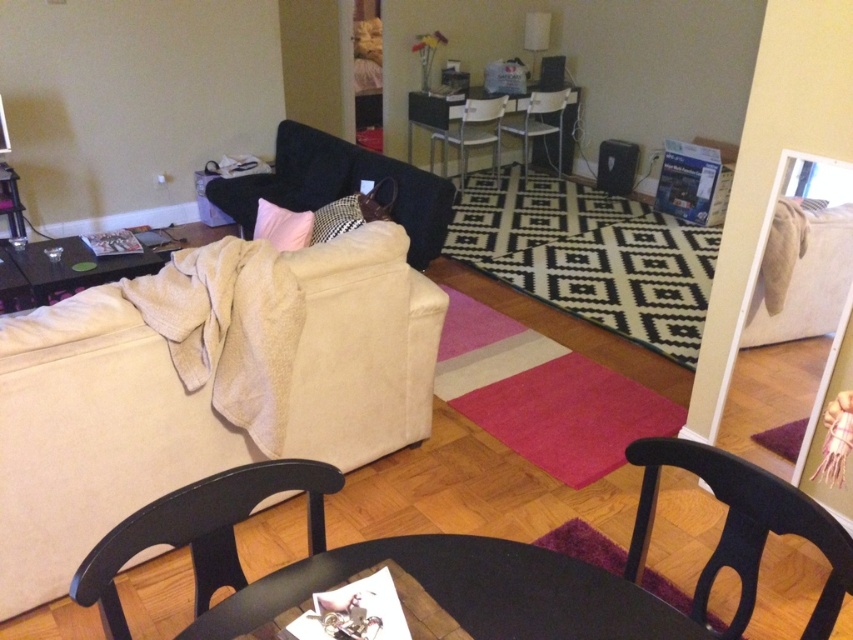
Question: Which of the following is the closest to the observer?

Choices:
 (A) (849, 547)
 (B) (489, 132)

Answer: (A)

Question: In this image, where is beige fabric couch at left located relative to velvet dark blue couch at center?

Choices:
 (A) right
 (B) left

Answer: (B)

Question: Which object is farther from the camera taking this photo?

Choices:
 (A) metallic silver armchair at center
 (B) black glossy table at center

Answer: (A)

Question: Is the position of black glossy table at center less distant than that of black glossy table at left?

Choices:
 (A) yes
 (B) no

Answer: (A)

Question: Considering the real-world distances, which object is closest to the velvet dark blue couch at center?

Choices:
 (A) black glossy table at left
 (B) wooden glossy table at center
 (C) checkered fabric pillow at center

Answer: (C)

Question: Does black wood armchair at lower center have a greater width compared to metallic silver armchair at center?

Choices:
 (A) yes
 (B) no

Answer: (B)